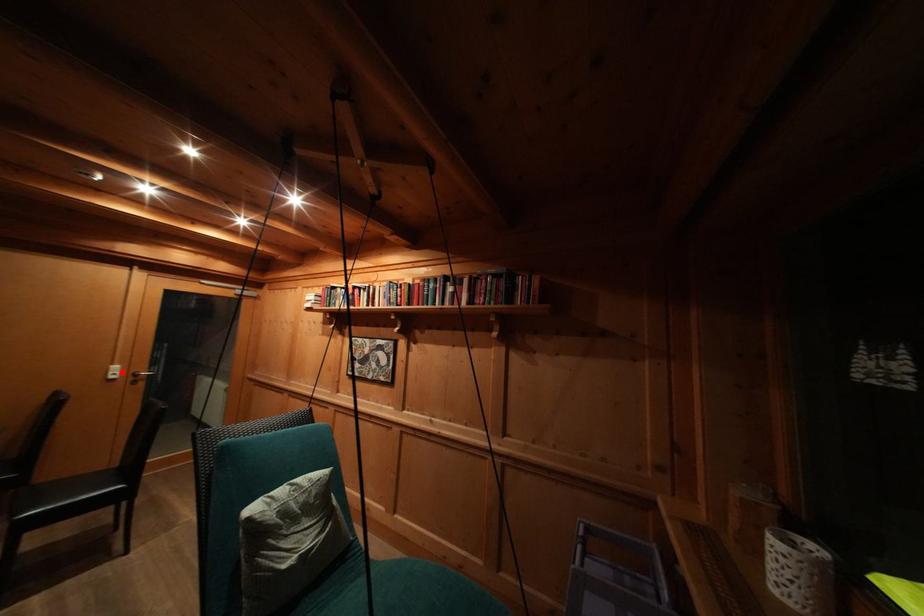
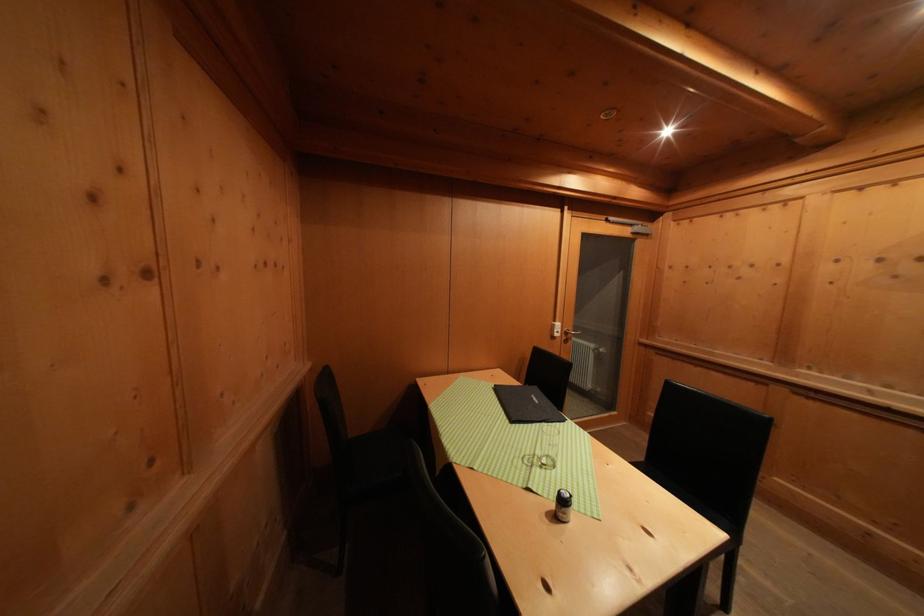
The point at the highlighted location is marked in the first image. Where is the corresponding point in the second image?

(564, 330)